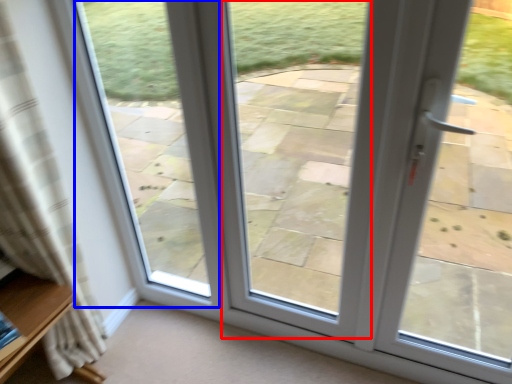
Question: Among these objects, which one is nearest to the camera, window (highlighted by a red box) or bay window (highlighted by a blue box)?

Choices:
 (A) window
 (B) bay window

Answer: (A)